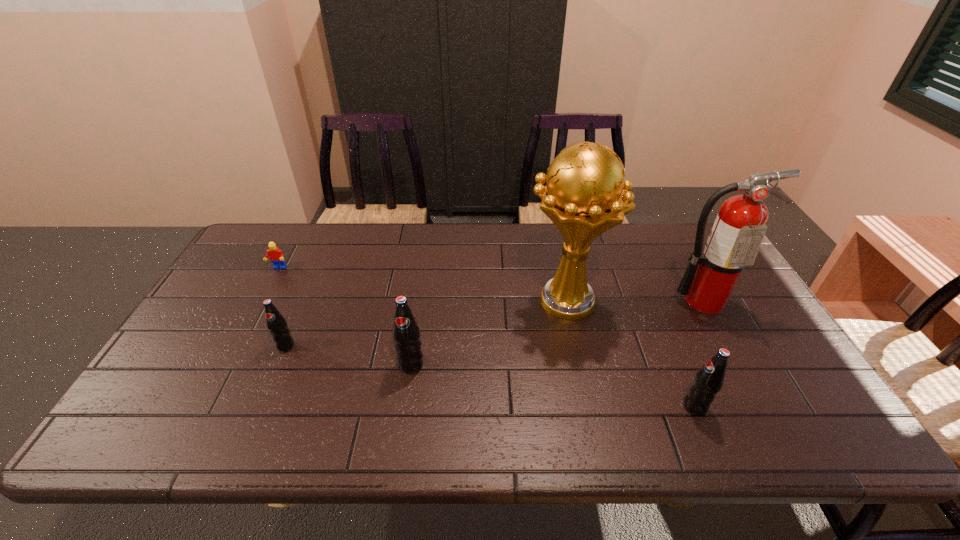
At what (x,y) coordinates should I click in order to perform the action: click on blank space at the near right corner. Please return your answer as a coordinate pair (x, y). Image resolution: width=960 pixels, height=540 pixels. Looking at the image, I should click on (815, 402).

This screenshot has width=960, height=540. I want to click on empty space that is in between the fourth tallest object and the leftmost pop, so click(x=491, y=376).

Where is `free space between the leftmost object and the fifth object from right to left`? free space between the leftmost object and the fifth object from right to left is located at coordinates (282, 307).

I want to click on vacant space that's between the fire extinguisher and the farthest pop, so click(494, 323).

Image resolution: width=960 pixels, height=540 pixels. What are the coordinates of `free space between the second farthest pop and the nearest object` in the screenshot? It's located at (553, 386).

The width and height of the screenshot is (960, 540). In order to click on vacant space that's between the shortest pop and the nearest object in this screenshot , I will do `click(491, 376)`.

Find the location of `free space that is in between the rightmost pop and the second shortest object`. free space that is in between the rightmost pop and the second shortest object is located at coordinates (491, 376).

Where is `empty space that is in between the second pop from right to left and the fifth tallest object`? This screenshot has height=540, width=960. empty space that is in between the second pop from right to left and the fifth tallest object is located at coordinates (348, 355).

Where is `vacant area that lies between the Lego and the nearest object`? This screenshot has width=960, height=540. vacant area that lies between the Lego and the nearest object is located at coordinates (487, 338).

Locate an element on the screen. vacant space that is in between the fire extinguisher and the farthest pop is located at coordinates (494, 323).